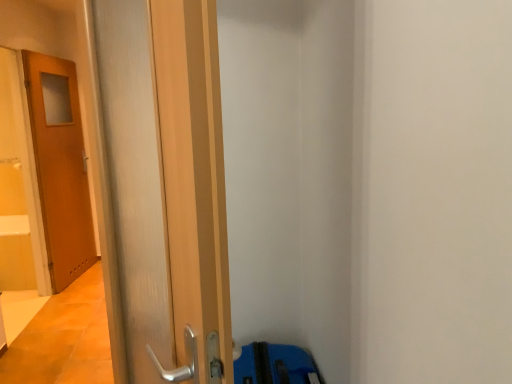
What do you see at coordinates (167, 178) in the screenshot?
I see `wooden door at left, the 1th door when ordered from right to left` at bounding box center [167, 178].

Identify the location of wooden door at left, the 2th door positioned from the left. (167, 178).

This screenshot has width=512, height=384. What do you see at coordinates (60, 166) in the screenshot?
I see `wooden door at left, marked as the second door in a front-to-back arrangement` at bounding box center [60, 166].

Locate an element on the screen. The width and height of the screenshot is (512, 384). wooden door at left, positioned as the 1th door in left-to-right order is located at coordinates (60, 166).

In order to click on wooden door at left, the second door in the back-to-front sequence in this screenshot , I will do 167,178.

Is wooden door at left, the second door in the back-to-front sequence, to the left or to the right of wooden door at left, marked as the second door in a front-to-back arrangement, in the image?

wooden door at left, the second door in the back-to-front sequence, is positioned on wooden door at left, marked as the second door in a front-to-back arrangement,'s right side.

Considering their positions, is wooden door at left, the 1th door when ordered from right to left, located in front of or behind wooden door at left, positioned as the 1th door in left-to-right order?

In the image, wooden door at left, the 1th door when ordered from right to left, appears in front of wooden door at left, positioned as the 1th door in left-to-right order.

Which is in front, point (232, 368) or point (47, 171)?

The point (232, 368) is in front.

From the image's perspective, relative to wooden door at left, positioned as the 1th door in left-to-right order, is wooden door at left, the first door when ordered from front to back, above or below?

Based on their image positions, wooden door at left, the first door when ordered from front to back, is located beneath wooden door at left, positioned as the 1th door in left-to-right order.

From a real-world perspective, which is physically below, wooden door at left, the 1th door when ordered from right to left, or wooden door at left, the second door when ordered from right to left?

wooden door at left, the second door when ordered from right to left, is physically lower.

Can you confirm if wooden door at left, the 2th door positioned from the left, is thinner than wooden door at left, marked as the second door in a front-to-back arrangement?

Incorrect, the width of wooden door at left, the 2th door positioned from the left, is not less than that of wooden door at left, marked as the second door in a front-to-back arrangement.

Considering the sizes of wooden door at left, the 2th door positioned from the left, and wooden door at left, marked as the second door in a front-to-back arrangement, in the image, is wooden door at left, the 2th door positioned from the left, taller or shorter than wooden door at left, marked as the second door in a front-to-back arrangement,?

Clearly, wooden door at left, the 2th door positioned from the left, is shorter compared to wooden door at left, marked as the second door in a front-to-back arrangement.

Considering the relative sizes of wooden door at left, the 2th door positioned from the left, and wooden door at left, the 1th door in the back-to-front sequence, in the image provided, is wooden door at left, the 2th door positioned from the left, smaller than wooden door at left, the 1th door in the back-to-front sequence,?

Indeed, wooden door at left, the 2th door positioned from the left, has a smaller size compared to wooden door at left, the 1th door in the back-to-front sequence.

Is wooden door at left, the first door when ordered from front to back, located outside wooden door at left, the second door when ordered from right to left?

wooden door at left, the first door when ordered from front to back, is positioned outside wooden door at left, the second door when ordered from right to left.

Is wooden door at left, the 1th door when ordered from right to left, with wooden door at left, marked as the second door in a front-to-back arrangement?

wooden door at left, the 1th door when ordered from right to left, and wooden door at left, marked as the second door in a front-to-back arrangement, are not in contact.

Does wooden door at left, the first door when ordered from front to back, turn towards wooden door at left, positioned as the 1th door in left-to-right order?

No, wooden door at left, the first door when ordered from front to back, is not aimed at wooden door at left, positioned as the 1th door in left-to-right order.

How many degrees apart are the facing directions of wooden door at left, the 1th door when ordered from right to left, and wooden door at left, the second door when ordered from right to left?

147 degrees.

Consider the image. Measure the distance from wooden door at left, the 2th door positioned from the left, to wooden door at left, positioned as the 1th door in left-to-right order.

The distance of wooden door at left, the 2th door positioned from the left, from wooden door at left, positioned as the 1th door in left-to-right order, is 2.97 meters.

At what (x,y) coordinates should I click in order to perform the action: click on door on the right side of wooden door at left, marked as the second door in a front-to-back arrangement. Please return your answer as a coordinate pair (x, y). The image size is (512, 384). Looking at the image, I should click on (167, 178).

Between wooden door at left, positioned as the 1th door in left-to-right order, and wooden door at left, the 1th door when ordered from right to left, which one appears on the right side from the viewer's perspective?

Positioned to the right is wooden door at left, the 1th door when ordered from right to left.

Is wooden door at left, marked as the second door in a front-to-back arrangement, positioned behind wooden door at left, the 1th door when ordered from right to left?

Yes, it is.

Which is behind, point (73, 154) or point (178, 253)?

Positioned behind is point (73, 154).

From the image's perspective, is wooden door at left, the 1th door in the back-to-front sequence, located beneath wooden door at left, the second door in the back-to-front sequence?

No, from the image's perspective, wooden door at left, the 1th door in the back-to-front sequence, is not beneath wooden door at left, the second door in the back-to-front sequence.

From a real-world perspective, which is physically below, wooden door at left, the second door when ordered from right to left, or wooden door at left, the 1th door when ordered from right to left?

wooden door at left, the second door when ordered from right to left, is physically lower.

Considering the sizes of wooden door at left, positioned as the 1th door in left-to-right order, and wooden door at left, the first door when ordered from front to back, in the image, is wooden door at left, positioned as the 1th door in left-to-right order, wider or thinner than wooden door at left, the first door when ordered from front to back,?

In the image, wooden door at left, positioned as the 1th door in left-to-right order, appears to be more narrow than wooden door at left, the first door when ordered from front to back.

Who is taller, wooden door at left, the 1th door in the back-to-front sequence, or wooden door at left, the 2th door positioned from the left?

Standing taller between the two is wooden door at left, the 1th door in the back-to-front sequence.

Who is smaller, wooden door at left, marked as the second door in a front-to-back arrangement, or wooden door at left, the second door in the back-to-front sequence?

wooden door at left, the second door in the back-to-front sequence.

Consider the image. Would you say wooden door at left, marked as the second door in a front-to-back arrangement, is outside wooden door at left, the 2th door positioned from the left?

Yes.

Can you see wooden door at left, marked as the second door in a front-to-back arrangement, touching wooden door at left, the first door when ordered from front to back?

No, wooden door at left, marked as the second door in a front-to-back arrangement, is not with wooden door at left, the first door when ordered from front to back.

Is wooden door at left, marked as the second door in a front-to-back arrangement, oriented towards wooden door at left, the 2th door positioned from the left?

No, wooden door at left, marked as the second door in a front-to-back arrangement, is not turned towards wooden door at left, the 2th door positioned from the left.

Based on the photo, measure the distance between wooden door at left, marked as the second door in a front-to-back arrangement, and wooden door at left, the 2th door positioned from the left.

wooden door at left, marked as the second door in a front-to-back arrangement, is 2.97 meters away from wooden door at left, the 2th door positioned from the left.

Image resolution: width=512 pixels, height=384 pixels. Identify the location of door lying below the wooden door at left, positioned as the 1th door in left-to-right order (from the image's perspective). (167, 178).

I want to click on door on the left of the wooden door at left, the second door in the back-to-front sequence, so click(x=60, y=166).

Identify the location of door behind the wooden door at left, the second door in the back-to-front sequence. (60, 166).